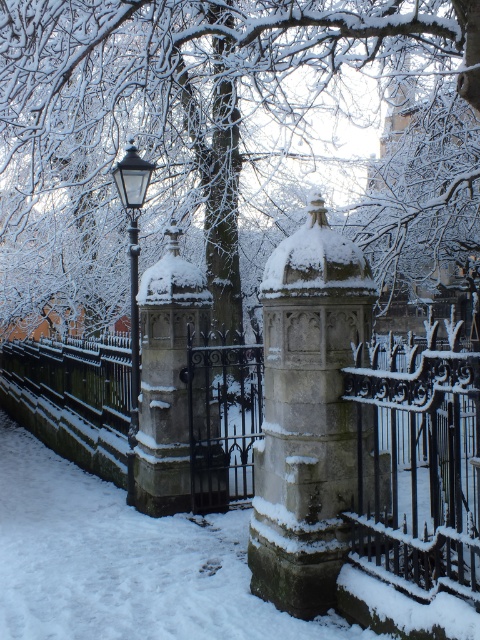
Question: Which point appears closest to the camera in this image?

Choices:
 (A) (420, 419)
 (B) (139, 189)

Answer: (A)

Question: Can you confirm if stone textured fence at center is positioned above polished brass lamp post at upper left?

Choices:
 (A) no
 (B) yes

Answer: (A)

Question: Can you confirm if stone textured fence at center is positioned above polished brass lamp post at upper left?

Choices:
 (A) yes
 (B) no

Answer: (B)

Question: Among these points, which one is nearest to the camera?

Choices:
 (A) (237, 348)
 (B) (132, 465)

Answer: (A)

Question: Is stone textured fence at center bigger than polished brass lamp post at upper left?

Choices:
 (A) yes
 (B) no

Answer: (A)